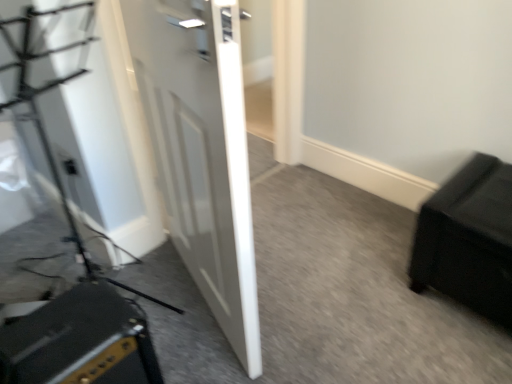
Question: Relative to black leather ottoman at lower right, is matte black outlet at lower left in front or behind?

Choices:
 (A) front
 (B) behind

Answer: (B)

Question: Looking at their shapes, would you say matte black outlet at lower left is wider or thinner than black leather ottoman at lower right?

Choices:
 (A) wide
 (B) thin

Answer: (B)

Question: Considering the real-world distances, which object is closest to the black matte speaker at lower left?

Choices:
 (A) black leather ottoman at lower right
 (B) white glossy door at center
 (C) matte black outlet at lower left

Answer: (B)

Question: Which object is positioned farthest from the black leather ottoman at lower right?

Choices:
 (A) matte black outlet at lower left
 (B) white glossy door at center
 (C) black matte speaker at lower left

Answer: (A)